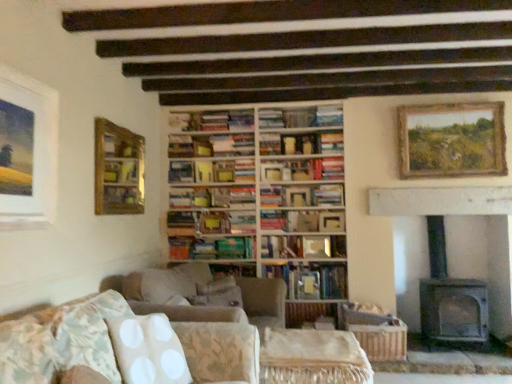
Find the location of a particular element. The width and height of the screenshot is (512, 384). green matte book at center, the sixth book viewed from the top is located at coordinates (211, 248).

The height and width of the screenshot is (384, 512). What do you see at coordinates (303, 221) in the screenshot?
I see `hardcover book at center, placed as the fourth book when sorted from top to bottom` at bounding box center [303, 221].

This screenshot has height=384, width=512. Describe the element at coordinates (212, 120) in the screenshot. I see `hardcover books at center, placed as the first book when sorted from top to bottom` at that location.

At what (x,y) coordinates should I click in order to perform the action: click on hardcover book at center, marked as the 2th book in a top-to-bottom arrangement. Please return your answer as a coordinate pair (x, y). This screenshot has width=512, height=384. Looking at the image, I should click on (328, 195).

I want to click on green matte book at center, the sixth book viewed from the top, so click(x=211, y=248).

Is floral fabric couch at lower left to the left of hardcover book at center, the third book when ordered from top to bottom, from the viewer's perspective?

Yes, floral fabric couch at lower left is to the left of hardcover book at center, the third book when ordered from top to bottom.

Where is `the 5th book behind the floral fabric couch at lower left, starting your count from the anchor`? the 5th book behind the floral fabric couch at lower left, starting your count from the anchor is located at coordinates (271, 195).

Are floral fabric couch at lower left and hardcover book at center, the 5th book when ordered from bottom to top, beside each other?

floral fabric couch at lower left is not next to hardcover book at center, the 5th book when ordered from bottom to top, and they're not touching.

Considering the relative sizes of floral fabric couch at lower left and hardcover book at center, the 5th book when ordered from bottom to top, in the image provided, is floral fabric couch at lower left bigger than hardcover book at center, the 5th book when ordered from bottom to top,?

Indeed, floral fabric couch at lower left has a larger size compared to hardcover book at center, the 5th book when ordered from bottom to top.

Which of these two, hardcover book at center, the third book when ordered from top to bottom, or hardcover book at center, marked as the 2th book in a top-to-bottom arrangement, is thinner?

Thinner between the two is hardcover book at center, marked as the 2th book in a top-to-bottom arrangement.

What's the angular difference between hardcover book at center, the third book when ordered from top to bottom, and hardcover book at center, acting as the 6th book starting from the bottom,'s facing directions?

They differ by 2.97 degrees in their facing directions.

From a real-world perspective, who is located higher, hardcover book at center, the third book when ordered from top to bottom, or hardcover book at center, marked as the 2th book in a top-to-bottom arrangement?

hardcover book at center, the third book when ordered from top to bottom, from a real-world perspective.

Considering the relative sizes of hardcover book at center, the third book when ordered from top to bottom, and hardcover book at center, acting as the 6th book starting from the bottom, in the image provided, is hardcover book at center, the third book when ordered from top to bottom, shorter than hardcover book at center, acting as the 6th book starting from the bottom,?

No, hardcover book at center, the third book when ordered from top to bottom, is not shorter than hardcover book at center, acting as the 6th book starting from the bottom.

Can you confirm if hardcover book at center, marked as the 2th book in a top-to-bottom arrangement, is bigger than wooden picture frame at center, the 2th picture frame viewed from the left?

Indeed, hardcover book at center, marked as the 2th book in a top-to-bottom arrangement, has a larger size compared to wooden picture frame at center, the 2th picture frame viewed from the left.

From a real-world perspective, who is located lower, hardcover book at center, marked as the 2th book in a top-to-bottom arrangement, or wooden picture frame at center, the 2th picture frame viewed from the left?

In real-world perspective, wooden picture frame at center, the 2th picture frame viewed from the left, is lower.

From the image's perspective, is hardcover book at center, acting as the 6th book starting from the bottom, below wooden picture frame at center, the 2th picture frame viewed from the left?

Actually, hardcover book at center, acting as the 6th book starting from the bottom, appears above wooden picture frame at center, the 2th picture frame viewed from the left, in the image.

Looking at this image, considering their positions, is hardcover book at center, acting as the 6th book starting from the bottom, located in front of or behind wooden picture frame at center, the 2th picture frame viewed from the left?

hardcover book at center, acting as the 6th book starting from the bottom, is in front of wooden picture frame at center, the 2th picture frame viewed from the left.

Is matte white picture frame at upper left, the third picture frame viewed from the right, positioned with its back to beige fabric side table at center?

No, matte white picture frame at upper left, the third picture frame viewed from the right,'s orientation is not away from beige fabric side table at center.

From the image's perspective, is matte white picture frame at upper left, which is the 1th picture frame from front to back, under beige fabric side table at center?

No.

From a real-world perspective, relative to beige fabric side table at center, is matte white picture frame at upper left, positioned as the 3th picture frame in back-to-front order, vertically above or below?

In terms of real-world spatial position, matte white picture frame at upper left, positioned as the 3th picture frame in back-to-front order, is above beige fabric side table at center.

Between wooden picture frame at center, which appears as the second picture frame when viewed from the right, and green matte book at center, the sixth book viewed from the top, which one appears on the left side from the viewer's perspective?

Positioned to the left is green matte book at center, the sixth book viewed from the top.

Considering the sizes of wooden picture frame at center, which appears as the second picture frame when viewed from the right, and green matte book at center, the sixth book viewed from the top, in the image, is wooden picture frame at center, which appears as the second picture frame when viewed from the right, bigger or smaller than green matte book at center, the sixth book viewed from the top,?

wooden picture frame at center, which appears as the second picture frame when viewed from the right, is smaller than green matte book at center, the sixth book viewed from the top.

Is wooden picture frame at center, the third picture frame in the front-to-back sequence, not near green matte book at center, the sixth book viewed from the top?

They are positioned close to each other.

Is point (111, 205) closer or farther from the camera than point (326, 288)?

Point (111, 205).

Is wooden bookshelf at upper center facing away from hardcover book at center, which is the 7th book from top to bottom?

No, wooden bookshelf at upper center's orientation is not away from hardcover book at center, which is the 7th book from top to bottom.

Considering the relative positions of wooden bookshelf at upper center and hardcover book at center, which is counted as the 1th book, starting from the bottom, in the image provided, is wooden bookshelf at upper center to the right of hardcover book at center, which is counted as the 1th book, starting from the bottom, from the viewer's perspective?

No.

Measure the distance from wooden bookshelf at upper center to hardcover book at center, which is counted as the 1th book, starting from the bottom.

wooden bookshelf at upper center is 1.63 meters from hardcover book at center, which is counted as the 1th book, starting from the bottom.

Would you consider gray stone fireplace at right to be distant from wooden bookshelf at center?

gray stone fireplace at right is positioned a significant distance from wooden bookshelf at center.

Based on the photo, could you tell me if gray stone fireplace at right is turned towards wooden bookshelf at center?

No.

Which is correct: gray stone fireplace at right is inside wooden bookshelf at center, or outside of it?

gray stone fireplace at right is outside wooden bookshelf at center.

The width and height of the screenshot is (512, 384). In order to click on book that is the 4th object located above the floral fabric couch at lower left (from the image's perspective) in this screenshot , I will do click(x=271, y=195).

Find the location of a particular element. the 4th book to the left of the hardcover book at center, marked as the 2th book in a top-to-bottom arrangement, starting your count from the anchor is located at coordinates (271, 195).

Which object lies further to the anchor point wooden bookshelf at center, wooden-framed painting at upper right, which appears as the 2th picture frame when viewed from the front, or hardcover book at center, marked as the 4th book in a bottom-to-top arrangement?

wooden-framed painting at upper right, which appears as the 2th picture frame when viewed from the front, is positioned further to the anchor wooden bookshelf at center.

Estimate the real-world distances between objects in this image. Which object is further from wooden bookshelf at upper center, green matte book at center, the sixth book viewed from the top, or hardcover books at center, placed as the first book when sorted from top to bottom?

green matte book at center, the sixth book viewed from the top.

From the image, which object appears to be nearer to hardcover book at center, acting as the 6th book starting from the bottom, hardcover book at center, marked as the 4th book in a bottom-to-top arrangement, or matte white picture frame at upper left, which is the 1th picture frame from front to back?

hardcover book at center, marked as the 4th book in a bottom-to-top arrangement.

When comparing their distances from wooden bookshelf at upper center, does gray stone fireplace at right or matte white picture frame at upper left, the third picture frame viewed from the right, seem closer?

The object closer to wooden bookshelf at upper center is matte white picture frame at upper left, the third picture frame viewed from the right.

Considering their positions, is hardcover book at center, marked as the 4th book in a bottom-to-top arrangement, positioned closer to hardcover book at center, which is the 7th book from top to bottom, than wooden-framed painting at upper right, which is the second picture frame in back-to-front order?

hardcover book at center, marked as the 4th book in a bottom-to-top arrangement, is closer to hardcover book at center, which is the 7th book from top to bottom.

Based on their spatial positions, is hardcover book at center, acting as the 6th book starting from the bottom, or floral fabric couch at lower left further from hardcover book at center, which is the 7th book from top to bottom?

Among the two, floral fabric couch at lower left is located further to hardcover book at center, which is the 7th book from top to bottom.

Considering their positions, is hardcover book at center, the third book when ordered from top to bottom, positioned closer to matte white picture frame at upper left, which is the 1th picture frame from front to back, than hardcover books at center, placed as the first book when sorted from top to bottom?

Based on the image, hardcover books at center, placed as the first book when sorted from top to bottom, appears to be nearer to matte white picture frame at upper left, which is the 1th picture frame from front to back.

Estimate the real-world distances between objects in this image. Which object is further from wooden bookshelf at center, gray stone fireplace at right or wooden picture frame at center, the third picture frame in the front-to-back sequence?

gray stone fireplace at right lies further to wooden bookshelf at center than the other object.

Identify the location of shelf between floral fabric couch at lower left and wooden bookshelf at center along the z-axis. (118, 169).

Find the location of `shelf between matte white picture frame at upper left, positioned as the 3th picture frame in back-to-front order, and green matte book at center, the second book in the bottom-to-top sequence, along the z-axis`. shelf between matte white picture frame at upper left, positioned as the 3th picture frame in back-to-front order, and green matte book at center, the second book in the bottom-to-top sequence, along the z-axis is located at coordinates (118, 169).

Where is `fireplace between floral fabric couch at lower left and wooden picture frame at center, the 2th picture frame viewed from the left, along the z-axis`? Image resolution: width=512 pixels, height=384 pixels. fireplace between floral fabric couch at lower left and wooden picture frame at center, the 2th picture frame viewed from the left, along the z-axis is located at coordinates (440, 201).

Locate an element on the screen. This screenshot has height=384, width=512. side table between matte white picture frame at upper left, which is the 1th picture frame from front to back, and hardcover book at center, which is the 7th book from top to bottom, in the front-back direction is located at coordinates (312, 357).